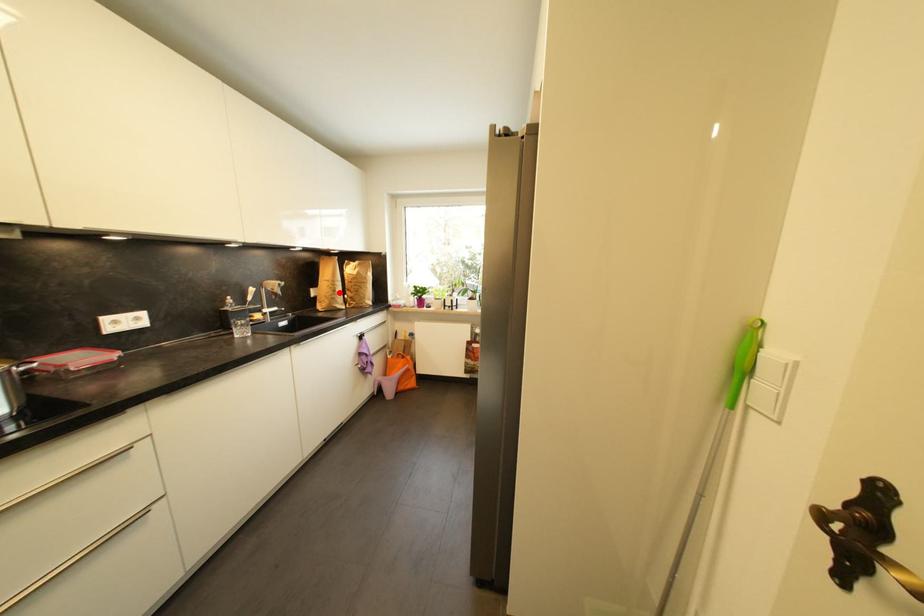
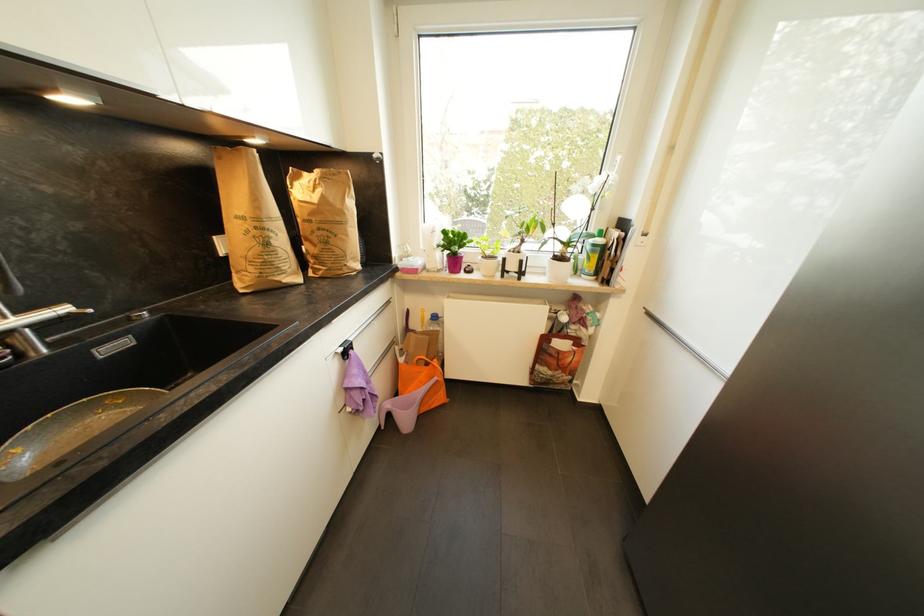
Where in the second image is the point corresponding to the highlighted location from the first image?

(272, 246)